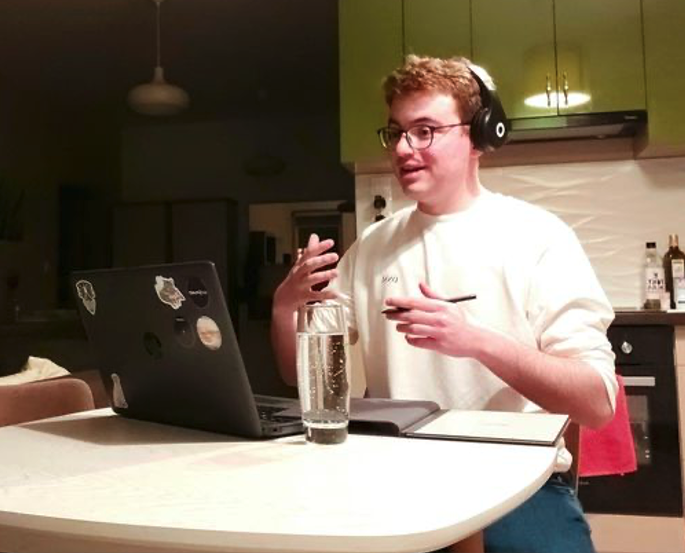
Where is `pen`? The height and width of the screenshot is (553, 685). pen is located at coordinates (455, 300).